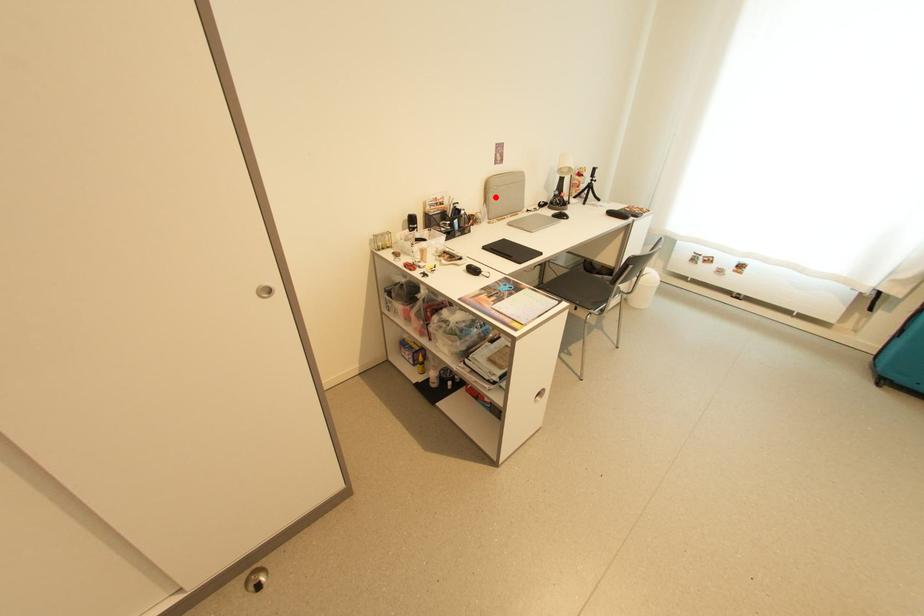
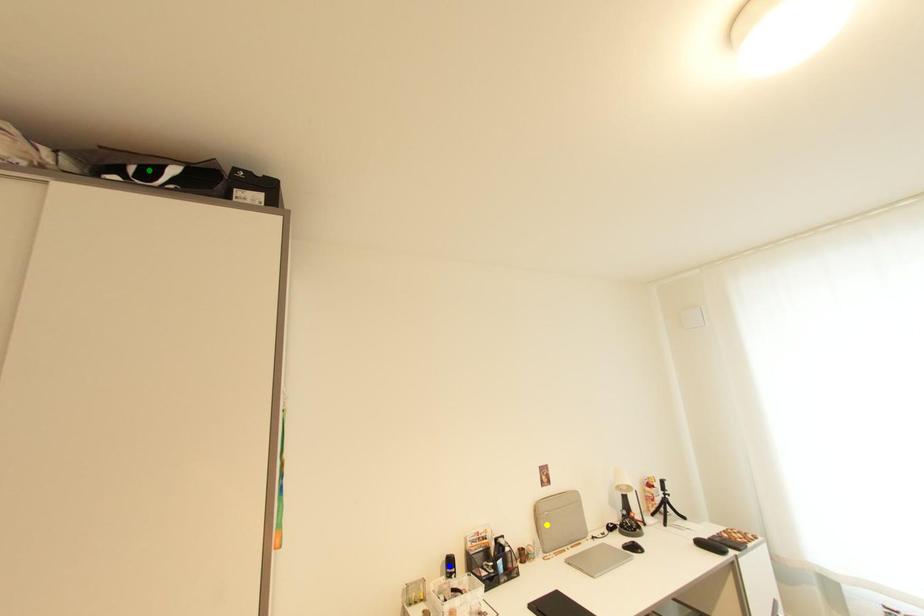
Question: I am providing you with two images of the same scene from different viewpoints. A red point is marked on the first image. You are given multiple points on the second image. Which point in image 2 is actually the same real-world point as the red point in image 1?

Choices:
 (A) green point
 (B) blue point
 (C) yellow point

Answer: (C)